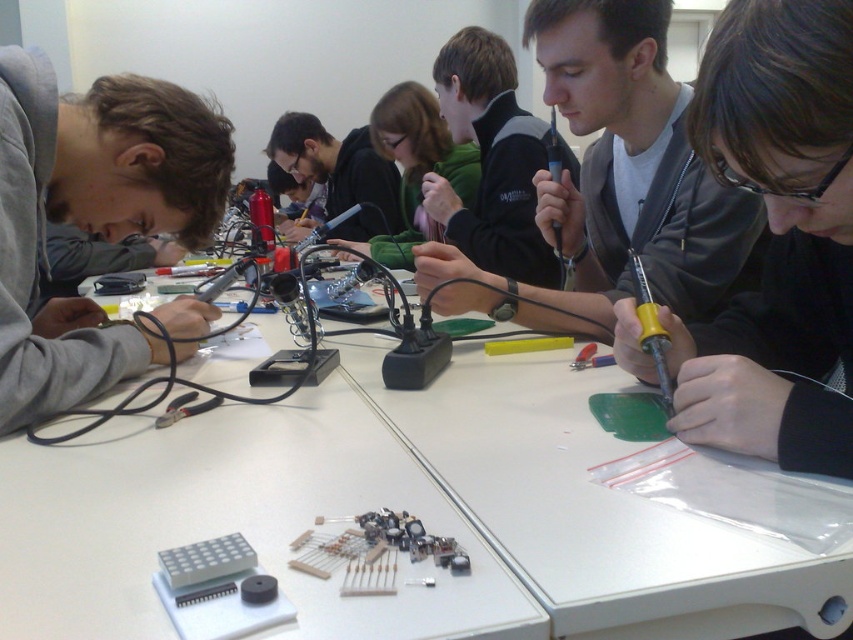
Question: Which of these objects is positioned farthest from the gray sweatshirt at left?

Choices:
 (A) white plastic table at center
 (B) matte black soldering iron at center

Answer: (B)

Question: Does white plastic table at center lie in front of yellow plastic screwdriver at center right?

Choices:
 (A) no
 (B) yes

Answer: (B)

Question: Can you confirm if white plastic table at center is positioned below matte black soldering iron at center?

Choices:
 (A) yes
 (B) no

Answer: (A)

Question: Which object is positioned closest to the white plastic table at center?

Choices:
 (A) matte black screwdriver at center
 (B) yellow plastic screwdriver at center right
 (C) gray sweatshirt at left

Answer: (A)

Question: Does matte black jacket at center have a lesser width compared to yellow plastic screwdriver at center right?

Choices:
 (A) no
 (B) yes

Answer: (A)

Question: Which of the following is the farthest from the observer?

Choices:
 (A) white plastic table at center
 (B) matte black jacket at center

Answer: (B)